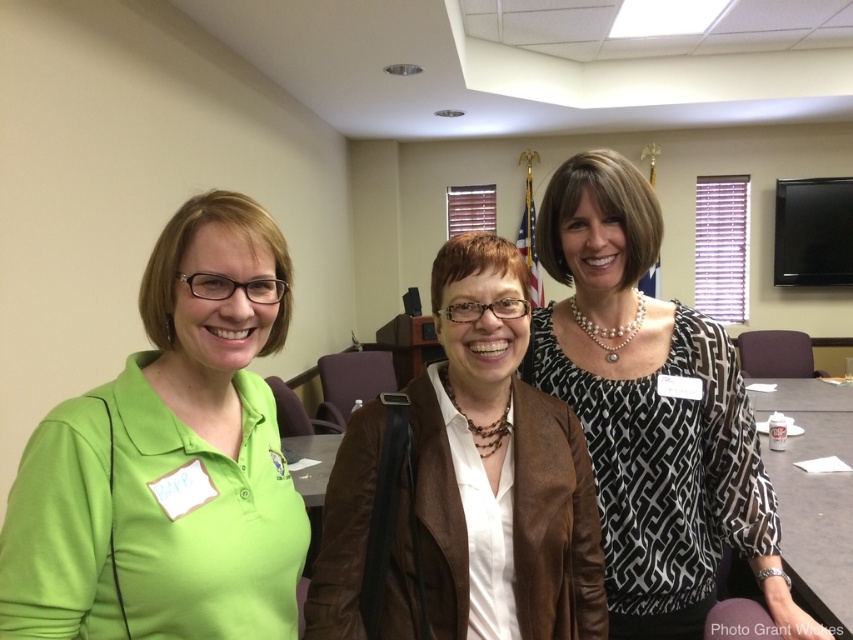
You are standing in a conference room and see the matte green polo shirt at left. If you want to hand a document to the person wearing it without moving closer than 30 inches, is the current distance sufficient?

The matte green polo shirt at left is 31.04 inches away from the viewer, so yes, the current distance is sufficient to hand a document without moving closer than 30 inches.

From the picture: You are a photographer setting up for a group photo in the conference room. You want to ensure that both the matte green polo shirt at left and the brown leather jacket at center are fully visible in the shot. Based on their positions, which clothing item is closer to the camera?

The matte green polo shirt at left is in front of the brown leather jacket at center, so it is closer to the camera and fully visible.